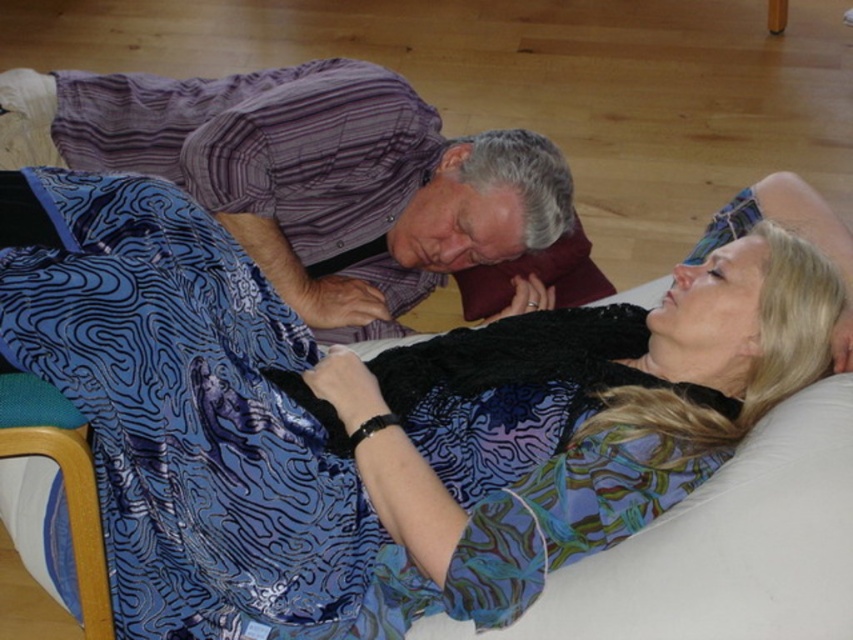
Is silky blue dress at center shorter than purple striped shirt at upper center?

Incorrect, silky blue dress at center's height does not fall short of purple striped shirt at upper center's.

Who is more forward, (483, 380) or (329, 221)?

Point (483, 380) is more forward.

Where is `silky blue dress at center`? This screenshot has height=640, width=853. silky blue dress at center is located at coordinates (380, 419).